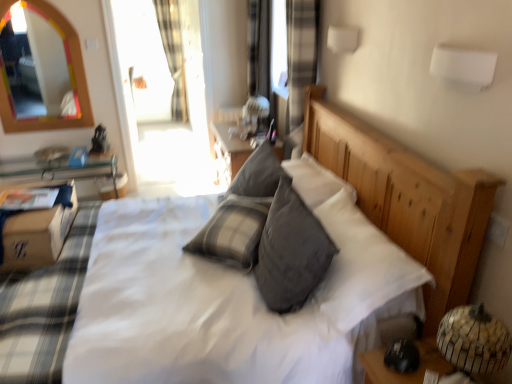
Question: From the image's perspective, is plaid fabric curtain at upper left over brown cardboard box at lower left?

Choices:
 (A) yes
 (B) no

Answer: (A)

Question: Is plaid fabric curtain at upper left far from brown cardboard box at lower left?

Choices:
 (A) no
 (B) yes

Answer: (B)

Question: Does plaid fabric curtain at upper left have a lesser height compared to brown cardboard box at lower left?

Choices:
 (A) no
 (B) yes

Answer: (A)

Question: Can you confirm if plaid fabric curtain at upper left is thinner than brown cardboard box at lower left?

Choices:
 (A) no
 (B) yes

Answer: (B)

Question: From a real-world perspective, is plaid fabric curtain at upper left physically above brown cardboard box at lower left?

Choices:
 (A) yes
 (B) no

Answer: (A)

Question: Visually, is transparent glass door at upper center positioned to the left or to the right of white cotton bedspread at left?

Choices:
 (A) left
 (B) right

Answer: (B)

Question: Is transparent glass door at upper center inside the boundaries of white cotton bedspread at left, or outside?

Choices:
 (A) inside
 (B) outside

Answer: (B)

Question: In terms of width, does transparent glass door at upper center look wider or thinner when compared to white cotton bedspread at left?

Choices:
 (A) wide
 (B) thin

Answer: (B)

Question: From a real-world perspective, relative to white cotton bedspread at left, is transparent glass door at upper center vertically above or below?

Choices:
 (A) below
 (B) above

Answer: (B)

Question: Is point (4, 289) positioned closer to the camera than point (316, 241)?

Choices:
 (A) farther
 (B) closer

Answer: (A)

Question: In the image, is white cotton bedspread at left positioned in front of or behind gray soft pillow at center?

Choices:
 (A) behind
 (B) front

Answer: (B)

Question: Considering the positions of white cotton bedspread at left and gray soft pillow at center in the image, is white cotton bedspread at left taller or shorter than gray soft pillow at center?

Choices:
 (A) short
 (B) tall

Answer: (B)

Question: From a real-world perspective, relative to gray soft pillow at center, is white cotton bedspread at left vertically above or below?

Choices:
 (A) below
 (B) above

Answer: (A)

Question: Is white cotton bedspread at left inside the boundaries of brown cardboard box at lower left, or outside?

Choices:
 (A) outside
 (B) inside

Answer: (A)

Question: Considering their positions, is white cotton bedspread at left located in front of or behind brown cardboard box at lower left?

Choices:
 (A) front
 (B) behind

Answer: (A)